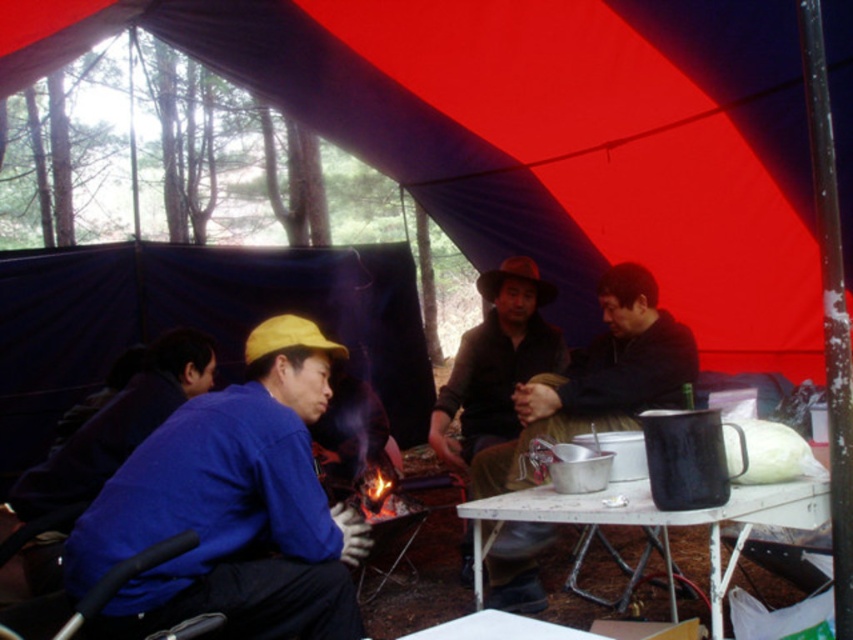
You are standing outside the tent and want to hand a marshmallow to the person wearing the matte black jacket at center inside the tent. The opening of the tent is 2 meters wide. Can you reach them without entering the tent?

The distance between the matte black jacket at center and the camera is 2.31 meters. Since the tent opening is only 2 meters wide, you cannot reach them without entering the tent because the distance is greater than the opening width.